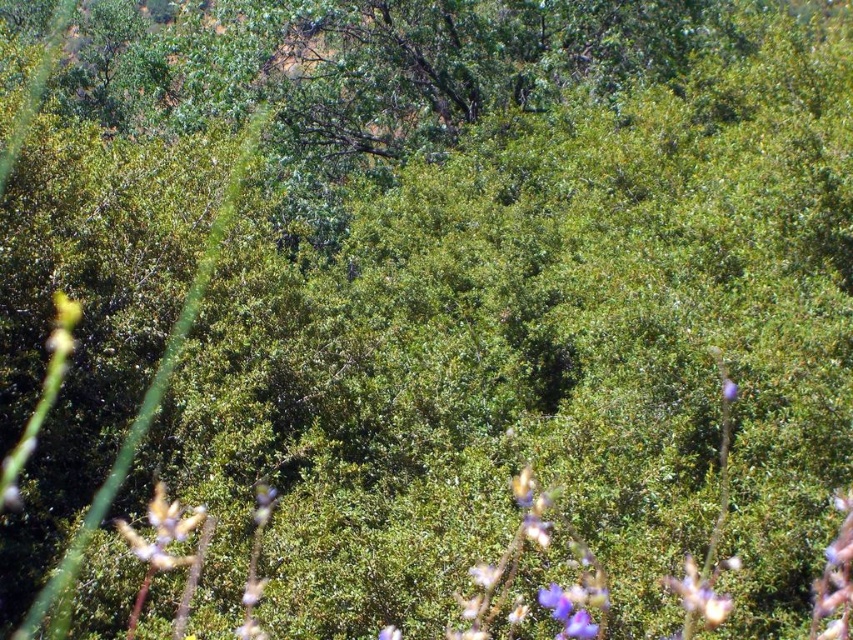
Locate an element on the screen. The height and width of the screenshot is (640, 853). purple matte flower at lower right is located at coordinates (698, 596).

Between point (670, 577) and point (722, 388), which one is positioned behind?

Positioned behind is point (722, 388).

Measure the distance between point (688, 573) and camera.

5.92 meters

Locate an element on the screen. purple matte flower at lower right is located at coordinates tap(698, 596).

Between purple matte flower at lower left and purple matte flower at upper right, which one appears on the right side from the viewer's perspective?

purple matte flower at upper right

Where is `purple matte flower at lower left`? purple matte flower at lower left is located at coordinates (161, 531).

The height and width of the screenshot is (640, 853). Find the location of `purple matte flower at lower left`. purple matte flower at lower left is located at coordinates (161, 531).

Is purple matte flower at lower left positioned before purple matte flower at lower right?

No, it is behind purple matte flower at lower right.

Between purple matte flower at lower left and purple matte flower at lower right, which one has less height?

Standing shorter between the two is purple matte flower at lower right.

Which is in front, point (187, 525) or point (695, 595)?

Point (695, 595) is more forward.

This screenshot has height=640, width=853. Identify the location of purple matte flower at lower left. (161, 531).